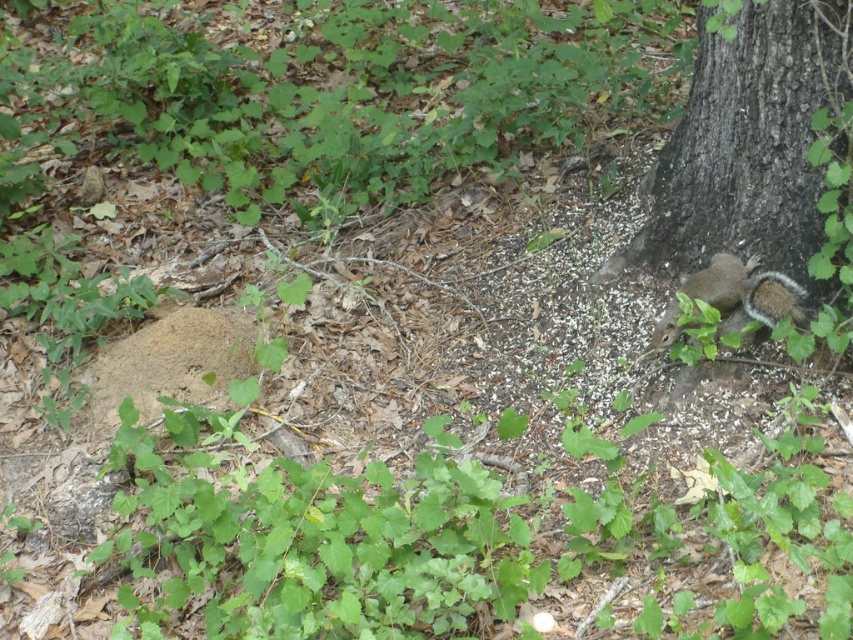
Question: Is brown rough bark tree at lower right to the left of gray-furred squirrel at lower right from the viewer's perspective?

Choices:
 (A) no
 (B) yes

Answer: (A)

Question: Which object is farther from the camera taking this photo?

Choices:
 (A) brown rough bark tree at lower right
 (B) gray-furred squirrel at lower right

Answer: (B)

Question: Can you confirm if brown rough bark tree at lower right is positioned to the left of gray-furred squirrel at lower right?

Choices:
 (A) yes
 (B) no

Answer: (B)

Question: From the image, what is the correct spatial relationship of brown rough bark tree at lower right in relation to gray-furred squirrel at lower right?

Choices:
 (A) left
 (B) right

Answer: (B)

Question: Which point is closer to the camera taking this photo?

Choices:
 (A) (798, 314)
 (B) (780, 268)

Answer: (A)

Question: Which of the following is the farthest from the observer?

Choices:
 (A) (743, 301)
 (B) (703, 20)

Answer: (B)